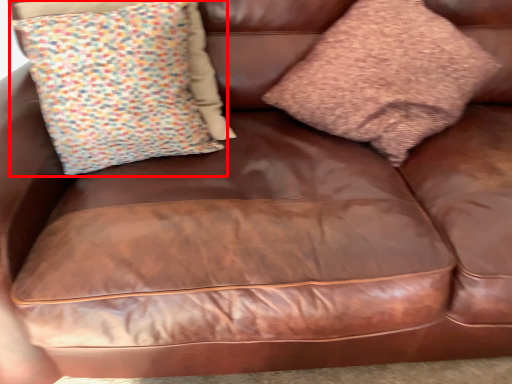
Question: From the image's perspective, where is pillow (annotated by the red box) located relative to pillow?

Choices:
 (A) below
 (B) above

Answer: (A)